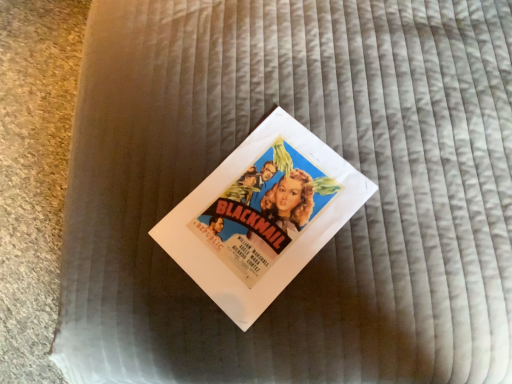
Question: Should I look upward or downward to see matte paper poster at center?

Choices:
 (A) down
 (B) up

Answer: (A)